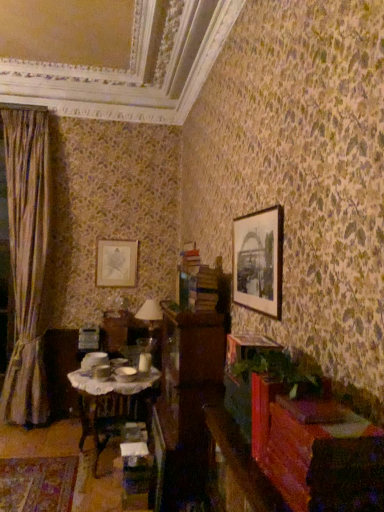
Question: Does matte black picture frame at upper right, placed as the 1th picture frame when sorted from right to left, turn towards wooden table with lace cloth at center?

Choices:
 (A) yes
 (B) no

Answer: (B)

Question: Does matte black picture frame at upper right, placed as the 1th picture frame when sorted from right to left, have a smaller size compared to wooden table with lace cloth at center?

Choices:
 (A) yes
 (B) no

Answer: (A)

Question: Does matte black picture frame at upper right, placed as the 1th picture frame when sorted from right to left, come behind wooden table with lace cloth at center?

Choices:
 (A) yes
 (B) no

Answer: (B)

Question: Is matte black picture frame at upper right, placed as the 1th picture frame when sorted from right to left, taller than wooden table with lace cloth at center?

Choices:
 (A) yes
 (B) no

Answer: (B)

Question: From a real-world perspective, is matte black picture frame at upper right, the 2th picture frame in the back-to-front sequence, physically above wooden table with lace cloth at center?

Choices:
 (A) no
 (B) yes

Answer: (B)

Question: Is wooden dresser at center spatially inside wooden table with lace cloth at center, or outside of it?

Choices:
 (A) inside
 (B) outside

Answer: (B)

Question: Would you say wooden dresser at center is to the left or to the right of wooden table with lace cloth at center in the picture?

Choices:
 (A) left
 (B) right

Answer: (B)

Question: Is point (215, 287) closer or farther from the camera than point (145, 412)?

Choices:
 (A) farther
 (B) closer

Answer: (B)

Question: Is wooden dresser at center wider or thinner than wooden table with lace cloth at center?

Choices:
 (A) wide
 (B) thin

Answer: (B)

Question: Is point (135, 414) positioned closer to the camera than point (155, 315)?

Choices:
 (A) closer
 (B) farther

Answer: (B)

Question: Is wooden table with lace cloth at center bigger or smaller than matte glass table lamp at center?

Choices:
 (A) small
 (B) big

Answer: (B)

Question: From the image's perspective, is wooden table with lace cloth at center located above or below matte glass table lamp at center?

Choices:
 (A) above
 (B) below

Answer: (B)

Question: Considering their positions, is wooden table with lace cloth at center located in front of or behind matte glass table lamp at center?

Choices:
 (A) behind
 (B) front

Answer: (B)

Question: From a real-world perspective, relative to wooden table with lace cloth at center, is matte black picture frame at upper right, the 2th picture frame in the back-to-front sequence, vertically above or below?

Choices:
 (A) below
 (B) above

Answer: (B)

Question: From the image's perspective, is matte black picture frame at upper right, the 1th picture frame viewed from the front, positioned above or below wooden table with lace cloth at center?

Choices:
 (A) above
 (B) below

Answer: (A)